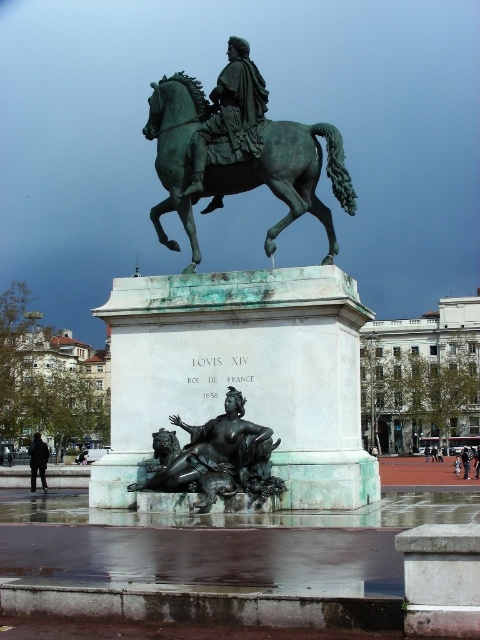
You are a tourist standing in the public square where the statue of Louis XIV is located. You notice a point marked at coordinates (240,164). What object is located at this point?

The point at coordinates (240,164) is where the green patina horse at center is located.

You are an art conservator examining the statue of Louis XIV. You notice the green patina bronze horse at center and the black matte jacket at lower left. Which object has a smaller width when viewed from the front?

The green patina bronze horse at center is thinner than the black matte jacket at lower left, so the green patina bronze horse at center has a smaller width when viewed from the front.

You are an art conservator examining the statue of Louis XIV in the public square. You notice a specific point marked at coordinates [238,317]. What object does this point correspond to?

The point at coordinates [238,317] corresponds to the green patina bronze horse at center.